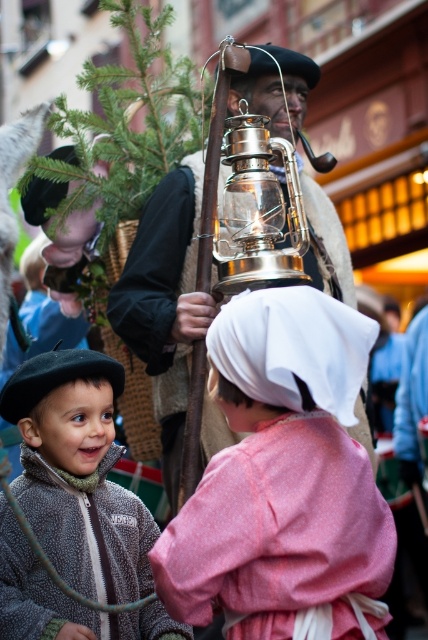
You are an event organizer planning to hang a decorative banner between the pink fabric dress at center and the shiny brass lantern at center. Since both are positioned at the center, can you hang the banner above them without it being blocked?

The pink fabric dress at center is below the shiny brass lantern at center, so hanging the banner above both would avoid blocking since the lantern is already above the dress.

You are organizing a costume display and need to know which costume takes up more space. Based on the image, which one is larger between the pink fabric dress at center and the fuzzy gray jacket at lower left?

The fuzzy gray jacket at lower left takes up more space than the pink fabric dress at center because the pink fabric dress at center occupies less space than fuzzy gray jacket at lower left.

You are a photographer at the event and want to place a decorative wreath exactly at point (x=77, y=474). The scene has a fuzzy gray jacket at lower left. Will the wreath placement at that point be visible without overlapping the fuzzy gray jacket at lower left?

The wreath placed at point (x=77, y=474) would overlap with the fuzzy gray jacket at lower left, so it will not be visible without overlapping.